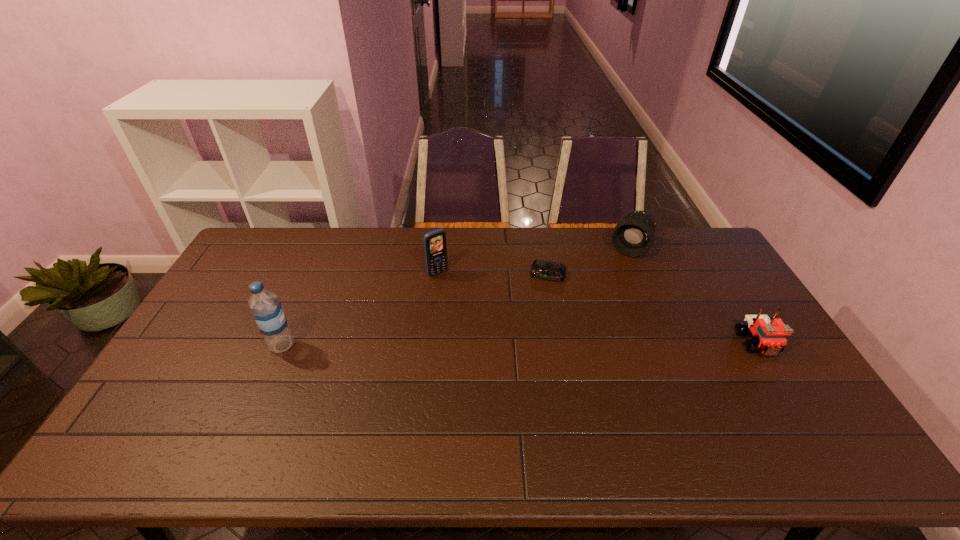
Identify the location of free region located on the label of the tallest object. pyautogui.click(x=367, y=346).

Where is `vacant space located on the front-facing side of the rightmost object`? This screenshot has width=960, height=540. vacant space located on the front-facing side of the rightmost object is located at coordinates (802, 416).

Locate an element on the screen. vacant region located on the display of the shortest object is located at coordinates (529, 356).

Locate an element on the screen. The image size is (960, 540). vacant space situated on the display of the shortest object is located at coordinates (528, 359).

At what (x,y) coordinates should I click in order to perform the action: click on free region located on the display of the shortest object. Please return your answer as a coordinate pair (x, y). This screenshot has width=960, height=540. Looking at the image, I should click on (529, 356).

Locate an element on the screen. vacant position located on the screen of the cellular telephone is located at coordinates (454, 291).

I want to click on free point located on the screen of the cellular telephone, so click(x=488, y=330).

Locate an element on the screen. free space located 0.140m on the screen of the cellular telephone is located at coordinates (463, 301).

Locate an element on the screen. The height and width of the screenshot is (540, 960). vacant space situated 0.100m at the front element of the farthest object is located at coordinates (616, 276).

Find the location of a particular element. This screenshot has width=960, height=540. vacant space located at the front element of the farthest object is located at coordinates (594, 320).